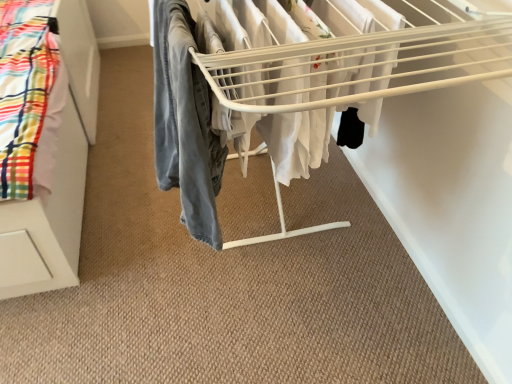
Question: Is white plastic drying rack at center further to camera compared to denim pants at center?

Choices:
 (A) yes
 (B) no

Answer: (B)

Question: Considering the relative sizes of white plastic drying rack at center and denim pants at center in the image provided, is white plastic drying rack at center wider than denim pants at center?

Choices:
 (A) no
 (B) yes

Answer: (B)

Question: Is white plastic drying rack at center not inside denim pants at center?

Choices:
 (A) yes
 (B) no

Answer: (A)

Question: Can you confirm if white plastic drying rack at center is smaller than denim pants at center?

Choices:
 (A) no
 (B) yes

Answer: (A)

Question: Is white plastic drying rack at center not near denim pants at center?

Choices:
 (A) yes
 (B) no

Answer: (B)

Question: Could you tell me if white plastic drying rack at center is facing denim pants at center?

Choices:
 (A) yes
 (B) no

Answer: (A)

Question: Is denim pants at center wider than white plastic drying rack at center?

Choices:
 (A) no
 (B) yes

Answer: (A)

Question: Could white plastic drying rack at center be considered to be inside denim pants at center?

Choices:
 (A) yes
 (B) no

Answer: (B)

Question: From a real-world perspective, is denim pants at center over white plastic drying rack at center?

Choices:
 (A) no
 (B) yes

Answer: (B)

Question: Can you confirm if denim pants at center is positioned to the right of white plastic drying rack at center?

Choices:
 (A) yes
 (B) no

Answer: (B)

Question: From the image's perspective, does denim pants at center appear higher than white plastic drying rack at center?

Choices:
 (A) no
 (B) yes

Answer: (A)

Question: Does denim pants at center lie behind white plastic drying rack at center?

Choices:
 (A) no
 (B) yes

Answer: (B)

Question: Looking at their shapes, would you say denim pants at center is wider or thinner than white plastic drying rack at center?

Choices:
 (A) thin
 (B) wide

Answer: (A)